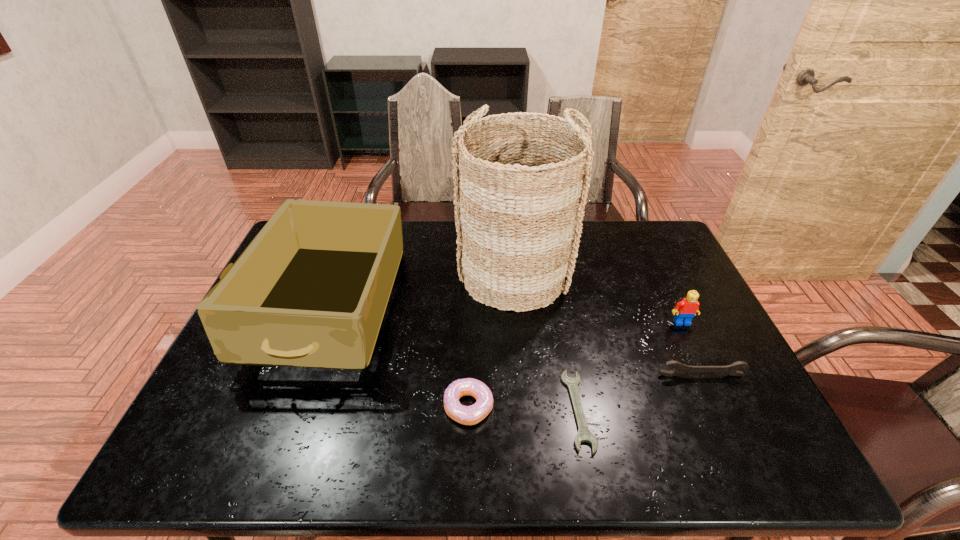
Where is `object situated at the far left corner`? The height and width of the screenshot is (540, 960). object situated at the far left corner is located at coordinates (311, 290).

I want to click on free space at the far edge, so click(416, 247).

The width and height of the screenshot is (960, 540). I want to click on free space at the left edge of the desktop, so click(274, 389).

Locate an element on the screen. Image resolution: width=960 pixels, height=540 pixels. vacant space at the right edge of the desktop is located at coordinates (673, 306).

In the image, there is a desktop. Where is `free space at the near right corner`? This screenshot has width=960, height=540. free space at the near right corner is located at coordinates (791, 461).

Locate an element on the screen. free spot between the third tallest object and the taller wrench is located at coordinates (691, 349).

The height and width of the screenshot is (540, 960). I want to click on free space that is in between the doughnut and the box, so click(x=398, y=357).

Locate an element on the screen. vacant area that lies between the Lego and the left wrench is located at coordinates (630, 366).

The image size is (960, 540). I want to click on free spot between the right wrench and the basket, so click(x=608, y=324).

Locate an element on the screen. The image size is (960, 540). blank region between the shorter wrench and the leftmost object is located at coordinates (454, 360).